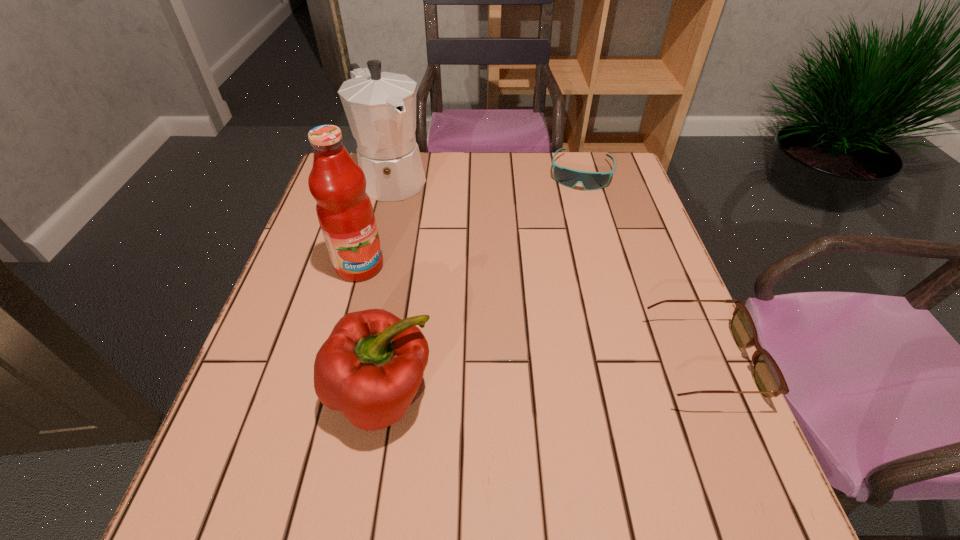
Where is `bell pepper`? This screenshot has width=960, height=540. bell pepper is located at coordinates (370, 368).

Locate an element on the screen. Image resolution: width=960 pixels, height=540 pixels. spectacles is located at coordinates (767, 375).

Locate an element on the screen. the third farthest object is located at coordinates (345, 213).

In order to click on the shortest object in this screenshot , I will do `click(568, 177)`.

Locate an element on the screen. The width and height of the screenshot is (960, 540). coffeepot is located at coordinates (380, 107).

Find the location of a particular element. This screenshot has height=540, width=960. free space located on the right of the bell pepper is located at coordinates (646, 394).

You are a GUI agent. You are given a task and a screenshot of the screen. Output one action in this format:
    pyautogui.click(x=<x>, y=<y>)
    Task: Click on the vacant position located 0.350m on the front label of the fruit juice
    
    Given the screenshot: What is the action you would take?
    pyautogui.click(x=489, y=363)

The image size is (960, 540). In order to click on free space located on the front label of the fruit juice in this screenshot , I will do click(x=392, y=290).

Where is `vacant area located on the front label of the fruit juice`? The width and height of the screenshot is (960, 540). vacant area located on the front label of the fruit juice is located at coordinates (477, 355).

Find the location of a particular element. vacant region located on the front-facing side of the sunglasses is located at coordinates (576, 204).